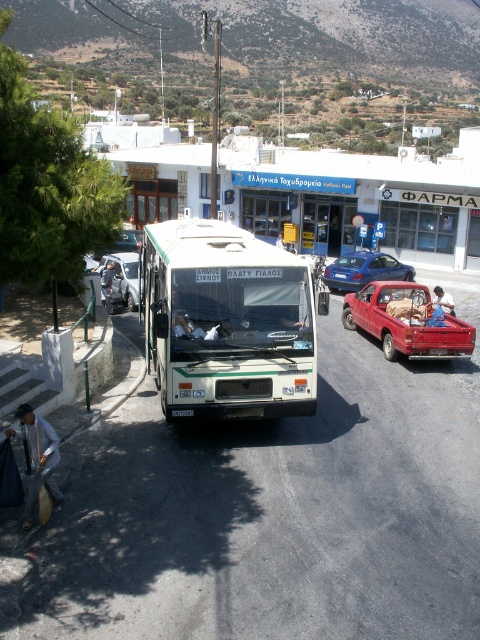
Question: Considering the real-world distances, which object is farthest from the white matte bus at center?

Choices:
 (A) light gray fabric bag at lower left
 (B) white matte tour bus at center

Answer: (B)

Question: Does blue metallic sedan at center appear under blue denim jeans at center?

Choices:
 (A) yes
 (B) no

Answer: (B)

Question: Is matte black jacket at center thinner than blue denim jeans at center?

Choices:
 (A) no
 (B) yes

Answer: (B)

Question: Which point is farther from the camera taking this photo?

Choices:
 (A) coord(113,268)
 (B) coord(158,301)
 (C) coord(104,275)

Answer: (A)

Question: Which point is closer to the camera?

Choices:
 (A) pos(347,276)
 (B) pos(424,326)
 (C) pos(35,477)

Answer: (C)

Question: Does white matte bus at center have a smaller size compared to light gray fabric bag at lower left?

Choices:
 (A) no
 (B) yes

Answer: (A)